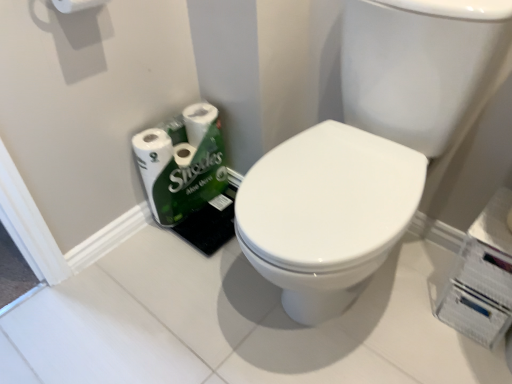
Where is `free spot below white glossy sink at center (from a real-world perspective)`? This screenshot has width=512, height=384. free spot below white glossy sink at center (from a real-world perspective) is located at coordinates pos(338,309).